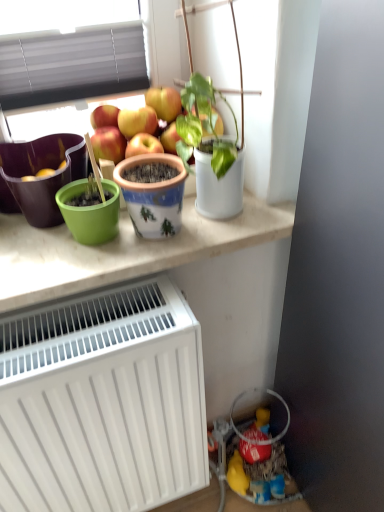
The height and width of the screenshot is (512, 384). What are the coordinates of `vacant area to the left of painted ceramic pot at center, which ranks as the 1th flowerpot in right-to-left order` in the screenshot? It's located at (54, 262).